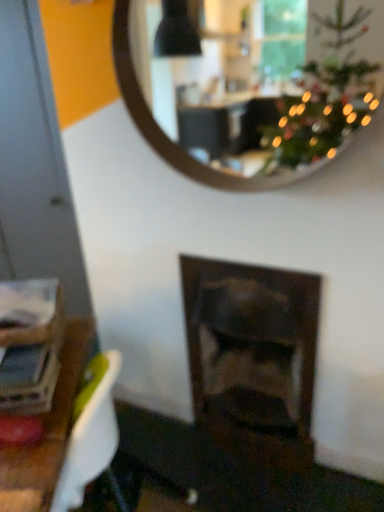
Question: Considering the positions of point (321, 129) and point (279, 285), is point (321, 129) closer or farther from the camera than point (279, 285)?

Choices:
 (A) closer
 (B) farther

Answer: (B)

Question: Considering the positions of wooden mirror at upper center and dark wood fireplace at center in the image, is wooden mirror at upper center bigger or smaller than dark wood fireplace at center?

Choices:
 (A) small
 (B) big

Answer: (A)

Question: From a real-world perspective, is wooden mirror at upper center positioned above or below dark wood fireplace at center?

Choices:
 (A) above
 (B) below

Answer: (A)

Question: Considering the positions of dark wood fireplace at center and wooden mirror at upper center in the image, is dark wood fireplace at center taller or shorter than wooden mirror at upper center?

Choices:
 (A) short
 (B) tall

Answer: (B)

Question: Choose the correct answer: Is dark wood fireplace at center inside wooden mirror at upper center or outside it?

Choices:
 (A) outside
 (B) inside

Answer: (A)

Question: From a real-world perspective, relative to wooden mirror at upper center, is dark wood fireplace at center vertically above or below?

Choices:
 (A) above
 (B) below

Answer: (B)

Question: In terms of width, does dark wood fireplace at center look wider or thinner when compared to wooden mirror at upper center?

Choices:
 (A) wide
 (B) thin

Answer: (A)